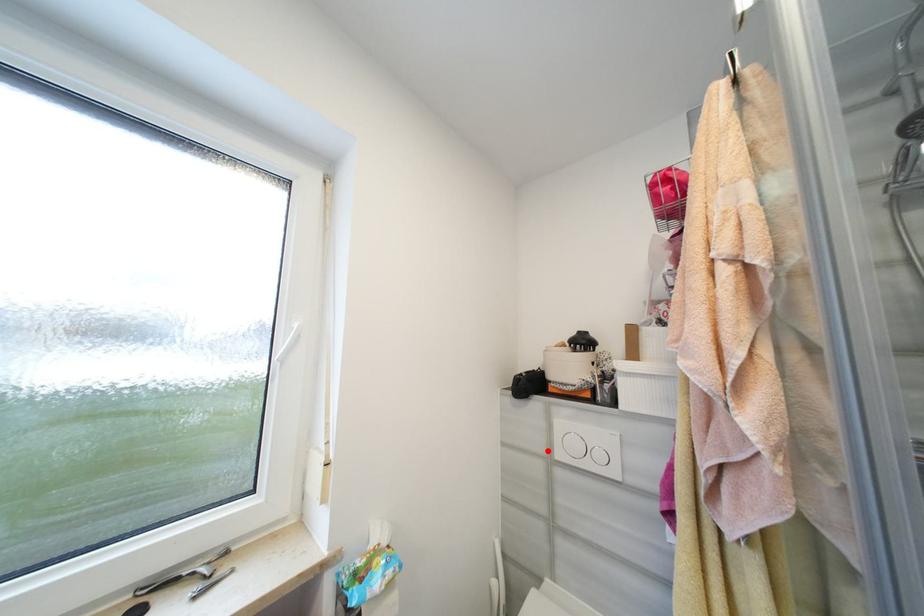
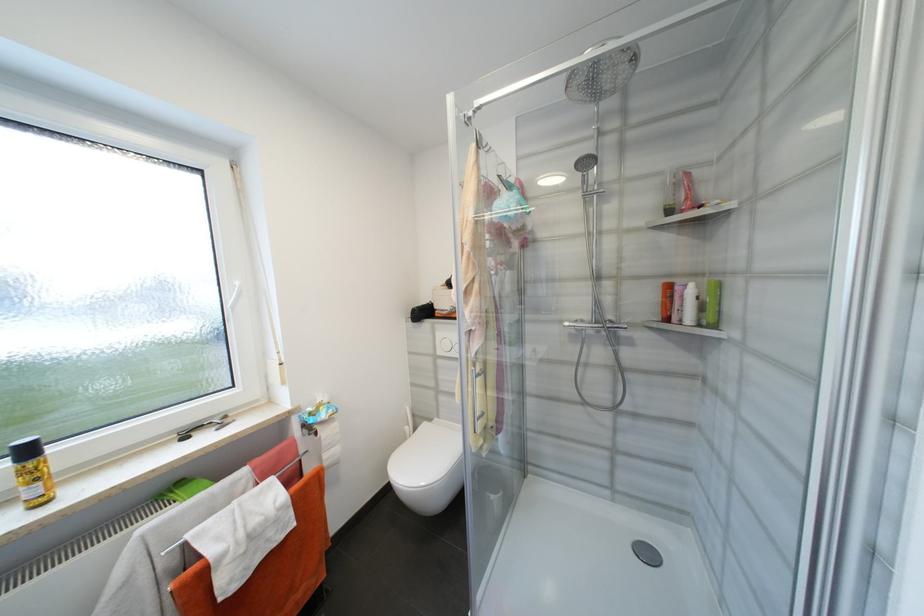
Where in the second image is the point corresponding to the highlighted location from the first image?

(436, 352)